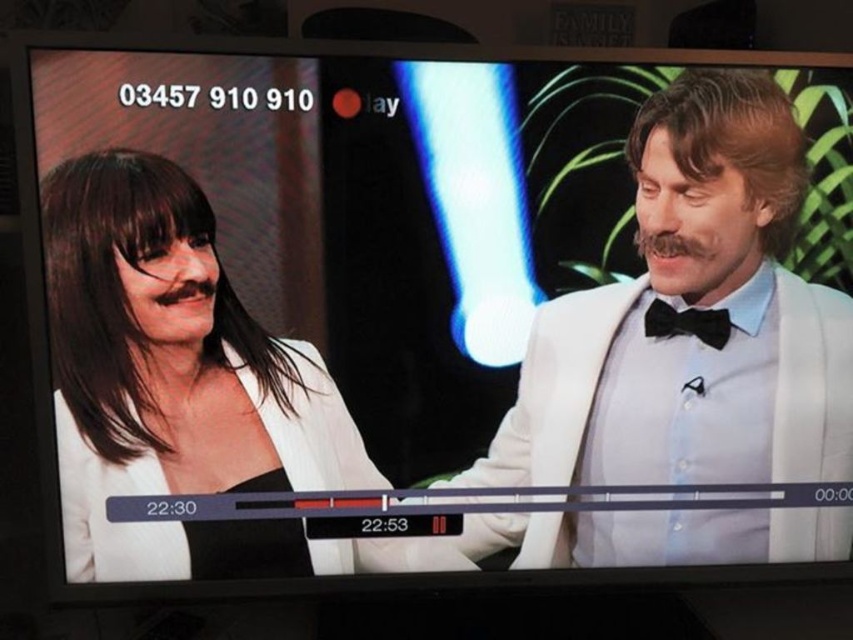
You are a fashion designer observing a mannequin wearing the white satin suit at right and the black satin bow tie at right. Which item is positioned closer to the center of the screen?

The white satin suit at right is positioned closer to the center of the screen because it is to the left of the black satin bow tie at right, meaning it is nearer to the middle compared to the bow tie.

In the scene shown: You are a fashion designer observing a talk show scene. You notice the matte white blazer at left and the black satin bow tie at right. Which clothing item is positioned more to the left side of the screen?

The matte white blazer at left is positioned more to the left side of the screen than the black satin bow tie at right.